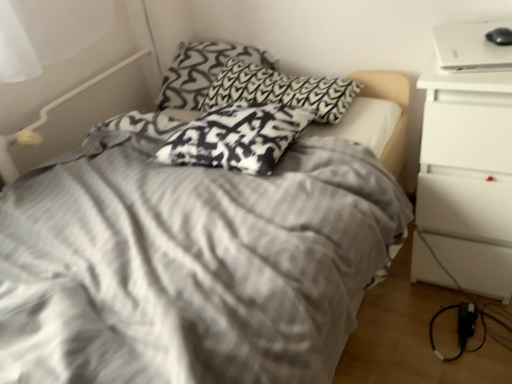
Question: Is white glossy laptop at upper right to the left or to the right of white matte nightstand at right in the image?

Choices:
 (A) right
 (B) left

Answer: (B)

Question: In terms of size, does white glossy laptop at upper right appear bigger or smaller than white matte nightstand at right?

Choices:
 (A) small
 (B) big

Answer: (A)

Question: Estimate the real-world distances between objects in this image. Which object is closer to the white matte nightstand at right?

Choices:
 (A) white glossy laptop at upper right
 (B) black and white patterned pillow at center, positioned as the 2th pillow in front-to-back order
 (C) black plastic power adapter at lower right
 (D) black and white patterned pillow at upper center, arranged as the 1th pillow when viewed from the back
 (E) gray striped bed at center

Answer: (A)

Question: Which object is positioned farthest from the white plastic bed frame at upper left?

Choices:
 (A) black plastic power adapter at lower right
 (B) black and white patterned pillow at upper center, arranged as the 1th pillow when viewed from the back
 (C) white matte nightstand at right
 (D) black and white patterned pillow at center, acting as the 3th pillow starting from the back
 (E) black and white patterned pillow at center, the second pillow positioned from the back

Answer: (A)